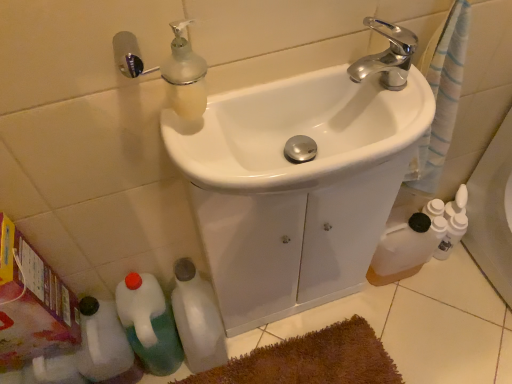
Question: Can you confirm if white glossy sink at center, the 1th sink when ordered from back to front, is positioned to the left of green plastic bottle at lower left, the second bottle viewed from the left?

Choices:
 (A) no
 (B) yes

Answer: (A)

Question: Is white glossy sink at center, the 1th sink when ordered from back to front, further to camera compared to green plastic bottle at lower left, which is the second bottle from right to left?

Choices:
 (A) yes
 (B) no

Answer: (B)

Question: From a real-world perspective, is white glossy sink at center, the 1th sink when ordered from back to front, located beneath green plastic bottle at lower left, which is the second bottle from right to left?

Choices:
 (A) yes
 (B) no

Answer: (B)

Question: Is the depth of white glossy sink at center, the 2th sink viewed from the front, less than that of green plastic bottle at lower left, the second bottle viewed from the left?

Choices:
 (A) no
 (B) yes

Answer: (B)

Question: Is white glossy sink at center, the 2th sink viewed from the front, aimed at green plastic bottle at lower left, the second bottle viewed from the left?

Choices:
 (A) yes
 (B) no

Answer: (B)

Question: Is white glossy sink at center, the 1th sink when ordered from back to front, not near green plastic bottle at lower left, the second bottle viewed from the left?

Choices:
 (A) yes
 (B) no

Answer: (B)

Question: Is white glossy sink at center, the 2th sink viewed from the front, in contact with white matte bottle at lower left, which is the 3th bottle from left to right?

Choices:
 (A) yes
 (B) no

Answer: (B)

Question: Does white glossy sink at center, the 1th sink when ordered from back to front, have a lesser width compared to white matte bottle at lower left, which is the 1th bottle in right-to-left order?

Choices:
 (A) no
 (B) yes

Answer: (B)

Question: Is white glossy sink at center, the 2th sink viewed from the front, further to camera compared to white matte bottle at lower left, which is the 3th bottle from left to right?

Choices:
 (A) yes
 (B) no

Answer: (B)

Question: From the image's perspective, is white glossy sink at center, the 1th sink when ordered from back to front, above white matte bottle at lower left, which is the 3th bottle from left to right?

Choices:
 (A) yes
 (B) no

Answer: (A)

Question: Is white glossy sink at center, the 2th sink viewed from the front, looking in the opposite direction of white matte bottle at lower left, which is the 1th bottle in right-to-left order?

Choices:
 (A) no
 (B) yes

Answer: (A)

Question: From the image's perspective, is white glossy sink at center, the 1th sink when ordered from back to front, located beneath white matte bottle at lower left, which is the 3th bottle from left to right?

Choices:
 (A) no
 (B) yes

Answer: (A)

Question: Does white matte bottle at lower left, which is the 3th bottle from left to right, appear on the left side of white glossy sink at center, the 2th sink viewed from the front?

Choices:
 (A) no
 (B) yes

Answer: (B)